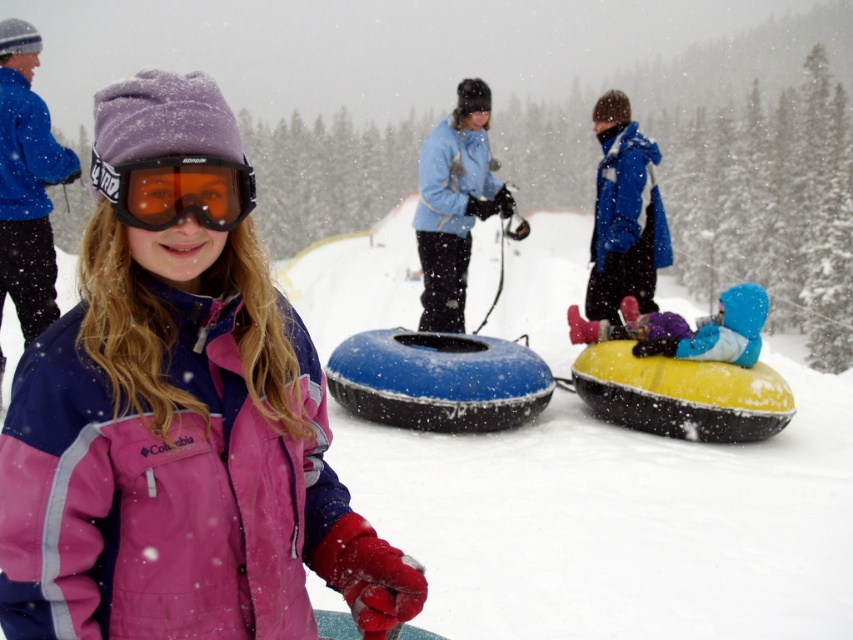
You are planning to build a snowman using the white fluffy snow at center and the blue fabric snowsuit at center. Which material is more suitable for the base of the snowman and why?

The white fluffy snow at center is more suitable for the base of the snowman because it is wider than the blue fabric snowsuit at center, providing a stable foundation.

What are the coordinates of the black matte goggles at center?

The black matte goggles at center are located at coordinates point [177,189].

You are a photographer standing at the edge of the snowy slope. You want to capture a photo of both the black matte goggles at center and the blue fabric snowsuit at center in the same frame. Given that your camera has a maximum focus range of 6 meters, will you be able to include both objects in the photo?

The distance between the black matte goggles at center and the blue fabric snowsuit at center is 6.86 meters. Since the camera can only focus up to 6 meters, the objects are too far apart to be captured in the same frame.